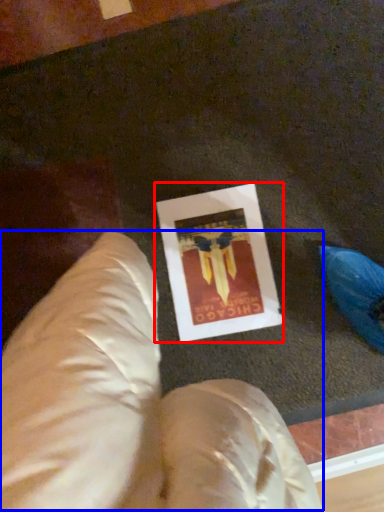
Question: Which point is closer to the camera, picture frame (highlighted by a red box) or bean bag chair (highlighted by a blue box)?

Choices:
 (A) picture frame
 (B) bean bag chair

Answer: (B)